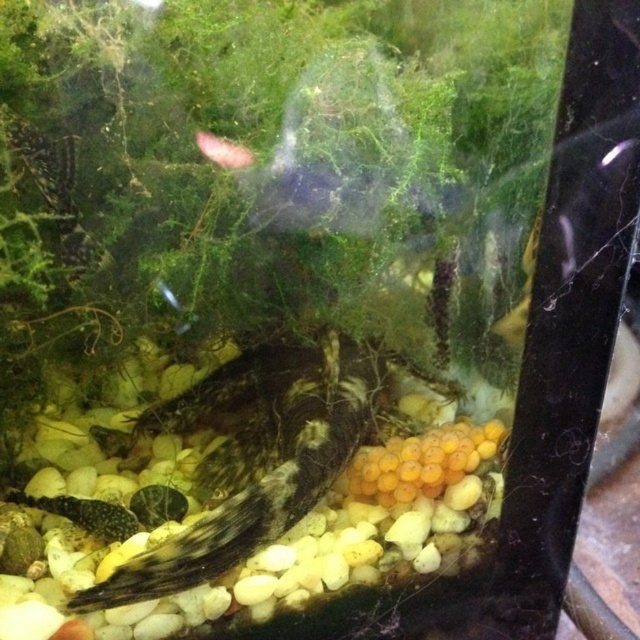
Does speckled brown fish at center have a larger size compared to pink translucent fish at upper center?

Indeed, speckled brown fish at center has a larger size compared to pink translucent fish at upper center.

Which is behind, point (230, 364) or point (227, 168)?

Positioned behind is point (230, 364).

Between point (348, 410) and point (211, 134), which one is positioned behind?

The point (348, 410) is more distant.

Identify the location of speckled brown fish at center. (260, 454).